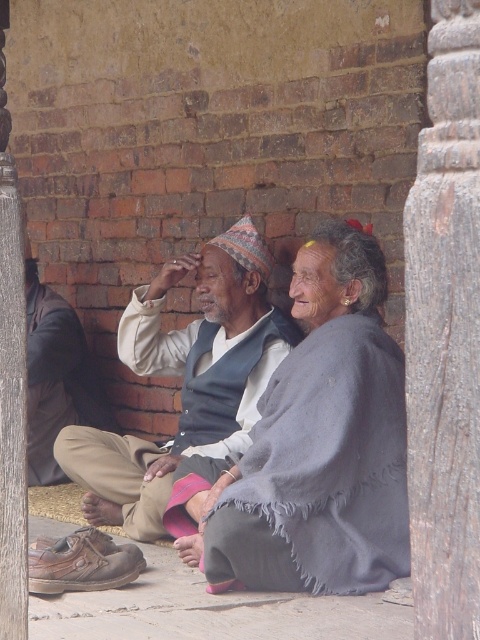
Which is behind, point (415, 305) or point (300, 257)?

The point (300, 257) is more distant.

Between wooden textured pillar at right and smooth skin forehead at center, which one is positioned higher?

Positioned higher is smooth skin forehead at center.

Which is behind, point (405, 236) or point (299, 248)?

The point (299, 248) is behind.

I want to click on wooden textured pillar at right, so click(444, 333).

Is gray woolen shawl at center above smooth skin forehead at center?

No, gray woolen shawl at center is not above smooth skin forehead at center.

Does gray woolen shawl at center appear under smooth skin forehead at center?

Correct, gray woolen shawl at center is located below smooth skin forehead at center.

This screenshot has height=640, width=480. What do you see at coordinates (323, 444) in the screenshot? I see `gray woolen shawl at center` at bounding box center [323, 444].

Where is `gray woolen shawl at center`? gray woolen shawl at center is located at coordinates (323, 444).

Between point (374, 369) and point (249, 246), which one is positioned in front?

Point (374, 369)

Does point (323, 524) lie behind point (210, 323)?

No, (323, 524) is in front of (210, 323).

What are the coordinates of `gray woolen shawl at center` in the screenshot? It's located at (323, 444).